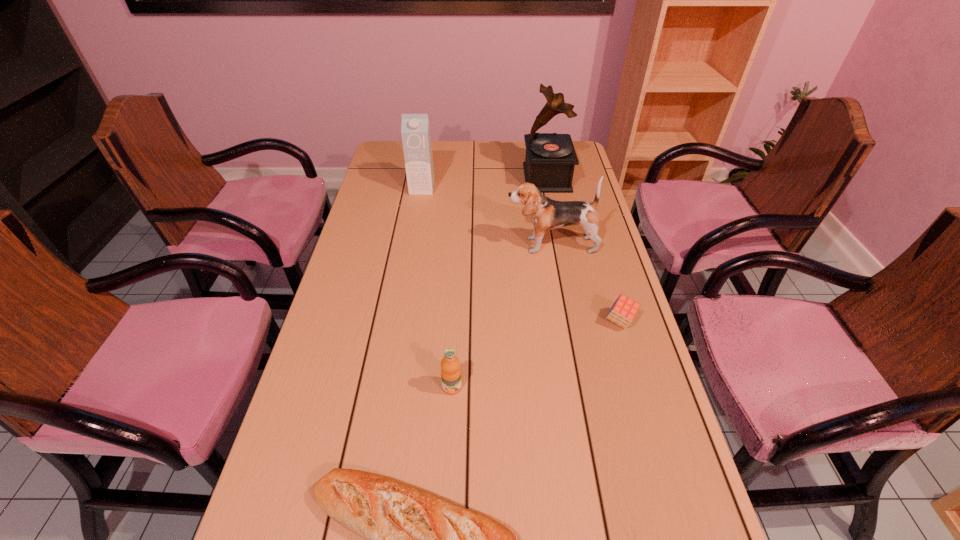
Identify the location of the tallest object. This screenshot has height=540, width=960. (550, 159).

At what (x,y) coordinates should I click in order to perform the action: click on carton. Please return your answer as a coordinate pair (x, y). The image size is (960, 540). Looking at the image, I should click on (415, 128).

Locate an element on the screen. puppy is located at coordinates (547, 214).

Find the location of a particular element. The height and width of the screenshot is (540, 960). orange juice is located at coordinates (450, 365).

The image size is (960, 540). I want to click on the fourth tallest object, so click(x=450, y=365).

I want to click on cube, so click(x=623, y=311).

Find the location of a particular element. This screenshot has height=540, width=960. free space located 0.130m at the horn opening of the phonograph_record is located at coordinates (491, 178).

Where is `vacant space located at the horn opening of the phonograph_record`? The image size is (960, 540). vacant space located at the horn opening of the phonograph_record is located at coordinates (475, 178).

What are the coordinates of `vacant space located at the horn opening of the phonograph_record` in the screenshot? It's located at (480, 178).

Where is `vacant area situated 0.120m on the front label of the carton`? vacant area situated 0.120m on the front label of the carton is located at coordinates (418, 214).